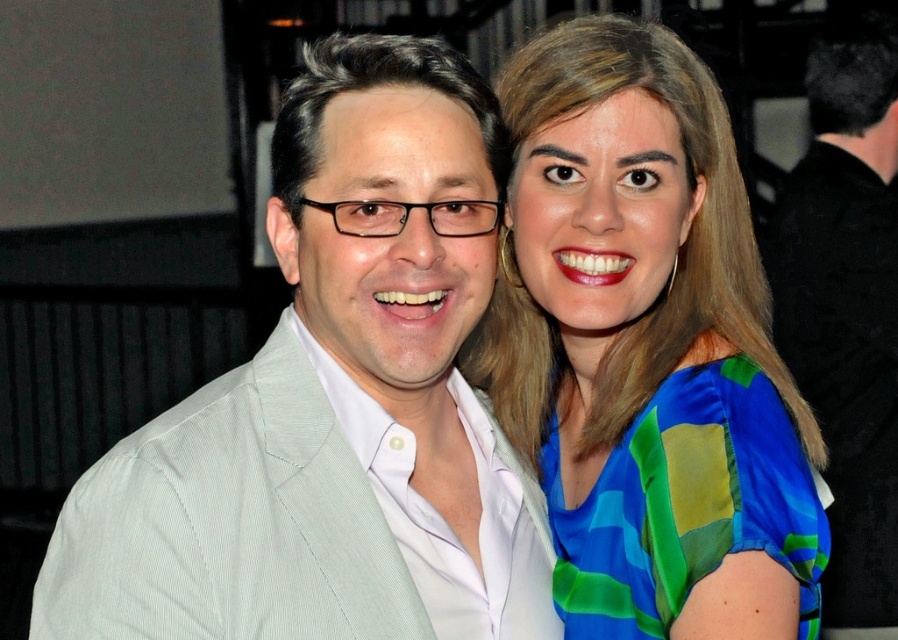
Does light gray suit at center appear on the right side of blue silk dress at upper right?

Incorrect, light gray suit at center is not on the right side of blue silk dress at upper right.

Looking at this image, measure the distance between light gray suit at center and camera.

4.11 feet

Identify the location of light gray suit at center. The height and width of the screenshot is (640, 898). (333, 403).

Can you confirm if black matte suit at right is positioned to the right of blue silk dress at upper right?

Indeed, black matte suit at right is positioned on the right side of blue silk dress at upper right.

Does black matte suit at right have a greater height compared to blue silk dress at upper right?

Yes, black matte suit at right is taller than blue silk dress at upper right.

Describe the element at coordinates (846, 304) in the screenshot. I see `black matte suit at right` at that location.

You are a GUI agent. You are given a task and a screenshot of the screen. Output one action in this format:
    pyautogui.click(x=<x>, y=<y>)
    Task: Click on the black matte suit at right
    The height and width of the screenshot is (640, 898).
    Given the screenshot: What is the action you would take?
    pyautogui.click(x=846, y=304)

Does silky blue-green blouse at upper right lie behind blue silk dress at upper right?

That is True.

Between silky blue-green blouse at upper right and blue silk dress at upper right, which one has less height?

blue silk dress at upper right

Is point (570, 604) positioned before point (638, 483)?

No, it is not.

The height and width of the screenshot is (640, 898). I want to click on silky blue-green blouse at upper right, so click(x=644, y=339).